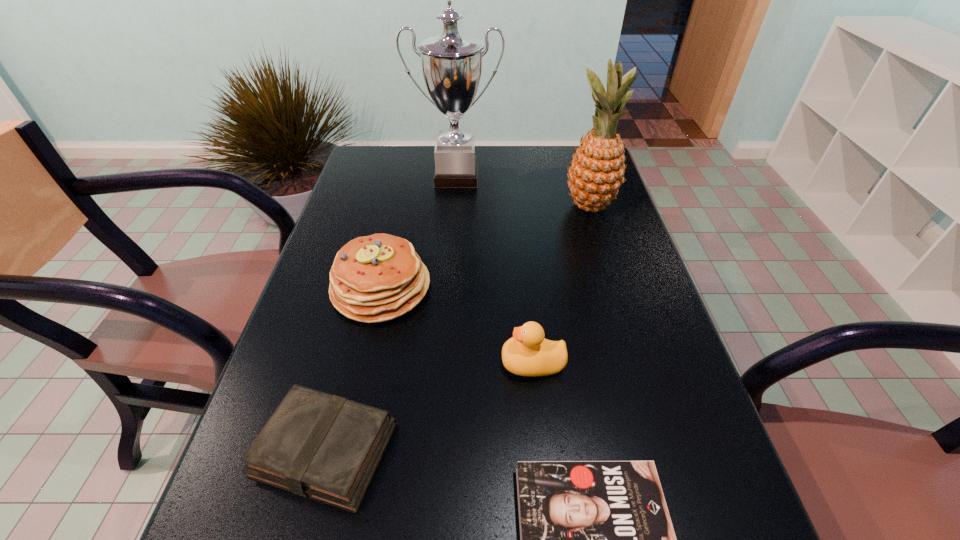
Locate an element on the screen. free space located on the face of the duck is located at coordinates (336, 363).

Image resolution: width=960 pixels, height=540 pixels. I want to click on vacant space located on the face of the duck, so click(311, 363).

Where is `vacant space located on the back of the second shortest object`? Image resolution: width=960 pixels, height=540 pixels. vacant space located on the back of the second shortest object is located at coordinates (365, 295).

You are a GUI agent. You are given a task and a screenshot of the screen. Output one action in this format:
    pyautogui.click(x=<x>, y=<y>)
    Task: Click on the object located in the far edge section of the desktop
    
    Given the screenshot: What is the action you would take?
    pyautogui.click(x=451, y=63)

At what (x,y) coordinates should I click in order to perform the action: click on pancake positioned at the left edge. Please return your answer as a coordinate pair (x, y). Looking at the image, I should click on (376, 278).

At what (x,y) coordinates should I click in order to perform the action: click on book that is at the left edge. Please return your answer as a coordinate pair (x, y). This screenshot has height=540, width=960. Looking at the image, I should click on (316, 445).

Locate an element on the screen. object located in the right edge section of the desktop is located at coordinates (596, 173).

Identify the location of free spot at the left edge of the desktop. (372, 195).

I want to click on free region at the right edge of the desktop, so click(x=629, y=374).

Locate an element on the screen. free location at the far left corner is located at coordinates (369, 181).